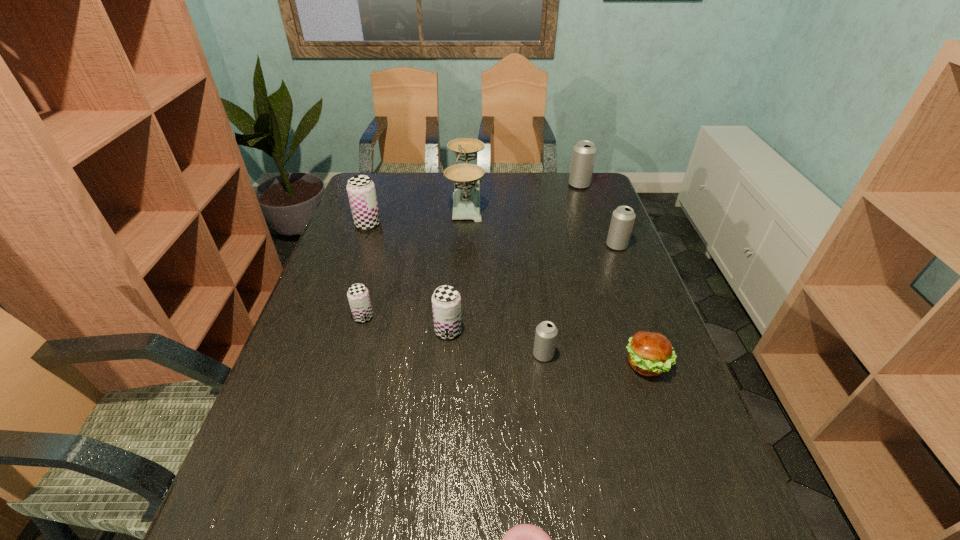
This screenshot has height=540, width=960. I want to click on vacant area situated 0.230m on the right of the nearest white beer can, so click(649, 355).

The height and width of the screenshot is (540, 960). I want to click on vacant area situated on the front of the second shortest object, so click(x=667, y=422).

You are a GUI agent. You are given a task and a screenshot of the screen. Output one action in this format:
    pyautogui.click(x=<x>, y=<y>)
    Task: Click on the scale that is at the far edge
    The height and width of the screenshot is (540, 960).
    Given the screenshot: What is the action you would take?
    point(466,177)

What are the coordinates of `beer can at the far edge` in the screenshot? It's located at (584, 152).

You are a GUI agent. You are given a task and a screenshot of the screen. Output one action in this format:
    pyautogui.click(x=<x>, y=<y>)
    Task: Click on the hamburger that is positioned at the right edge
    
    Given the screenshot: What is the action you would take?
    pyautogui.click(x=650, y=353)

At what (x,y) coordinates should I click in order to perform the action: click on object present at the far right corner. Please return your answer as a coordinate pair (x, y). Looking at the image, I should click on (584, 152).

Locate an element on the screen. blank space at the far edge of the desktop is located at coordinates (531, 176).

In the image, there is a desktop. What are the coordinates of `vacant space at the near edge` in the screenshot? It's located at (472, 539).

In the image, there is a desktop. What are the coordinates of `vacant space at the left edge` in the screenshot? It's located at (258, 502).

This screenshot has height=540, width=960. In order to click on vacant space at the right edge of the desktop in this screenshot , I will do `click(621, 305)`.